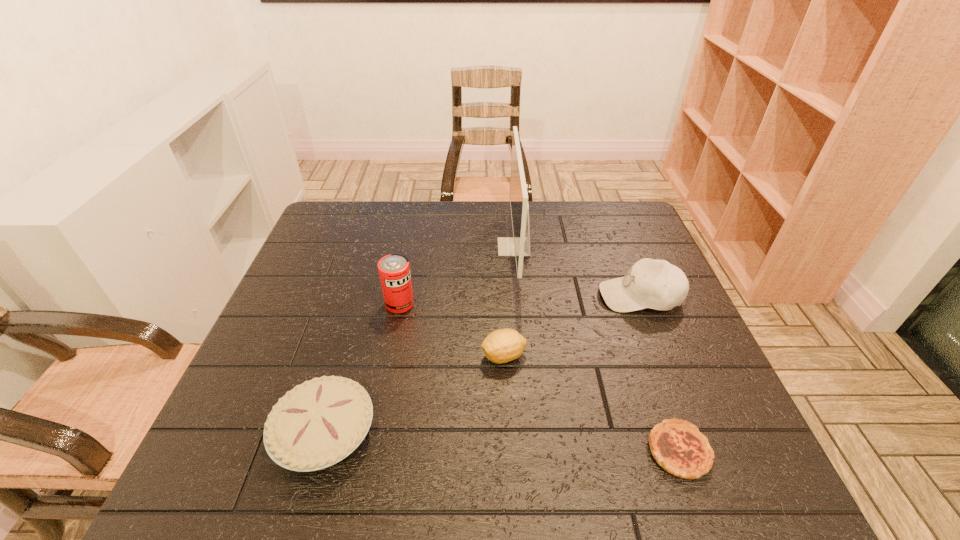
This screenshot has width=960, height=540. Identify the location of vacant space at the far right corner. (596, 213).

I want to click on free point between the lemon and the second tallest object, so click(452, 330).

Where is `vacant point located between the monitor and the baseball cap`? This screenshot has width=960, height=540. vacant point located between the monitor and the baseball cap is located at coordinates (577, 271).

I want to click on vacant area that lies between the pie and the can, so click(362, 368).

Identify the location of vacant region between the second tallest object and the quiche. (540, 377).

Where is `free space that is in between the third tallest object and the monitor`? The height and width of the screenshot is (540, 960). free space that is in between the third tallest object and the monitor is located at coordinates [577, 271].

This screenshot has height=540, width=960. In order to click on free point between the pie and the fourth shortest object in this screenshot , I will do `click(482, 364)`.

Locate an element on the screen. The width and height of the screenshot is (960, 540). vacant space that's between the fourth farthest object and the shortest object is located at coordinates (591, 403).

At what (x,y) coordinates should I click in order to perform the action: click on free space between the quiche and the pie. Please return your answer as a coordinate pair (x, y). Looking at the image, I should click on (502, 441).

Find the location of a particular element. The width and height of the screenshot is (960, 540). free space between the fourth farthest object and the shortest object is located at coordinates (591, 403).